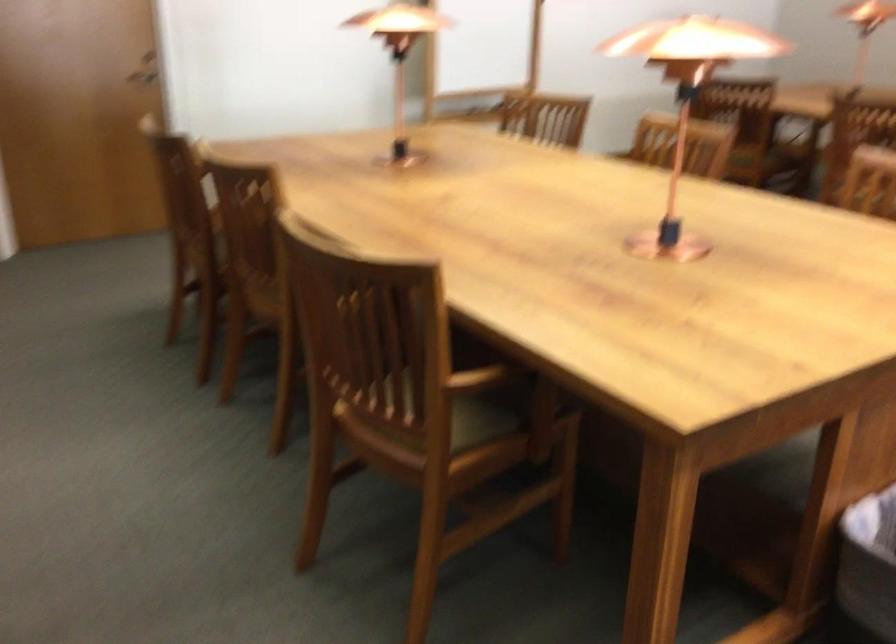
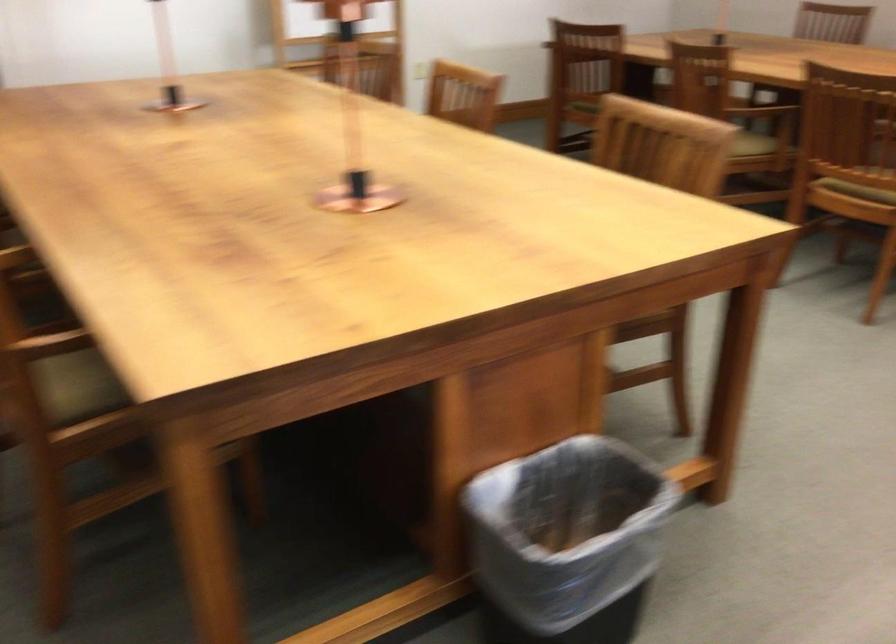
Where in the second image is the point corresponding to [448,422] from the first image?

(76, 386)